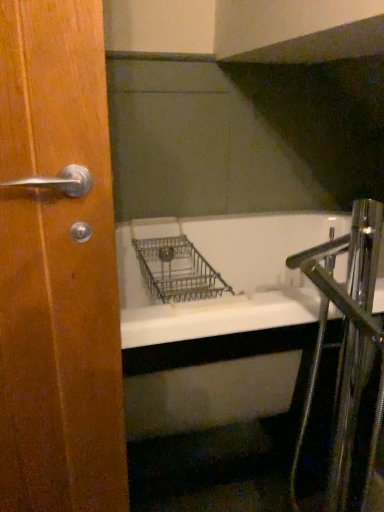
Question: Considering the positions of point (94, 166) and point (331, 261), is point (94, 166) closer or farther from the camera than point (331, 261)?

Choices:
 (A) farther
 (B) closer

Answer: (B)

Question: Considering the positions of wooden door handle at left and chrome metallic faucet at right in the image, is wooden door handle at left wider or thinner than chrome metallic faucet at right?

Choices:
 (A) wide
 (B) thin

Answer: (B)

Question: In terms of size, does wooden door handle at left appear bigger or smaller than chrome metallic faucet at right?

Choices:
 (A) small
 (B) big

Answer: (A)

Question: Which is correct: chrome metallic faucet at right is inside wooden door handle at left, or outside of it?

Choices:
 (A) inside
 (B) outside

Answer: (B)

Question: In the image, is chrome metallic faucet at right positioned in front of or behind wooden door handle at left?

Choices:
 (A) behind
 (B) front

Answer: (A)

Question: From their relative heights in the image, would you say chrome metallic faucet at right is taller or shorter than wooden door handle at left?

Choices:
 (A) short
 (B) tall

Answer: (A)

Question: In the image, is chrome metallic faucet at right on the left side or the right side of wooden door handle at left?

Choices:
 (A) left
 (B) right

Answer: (B)